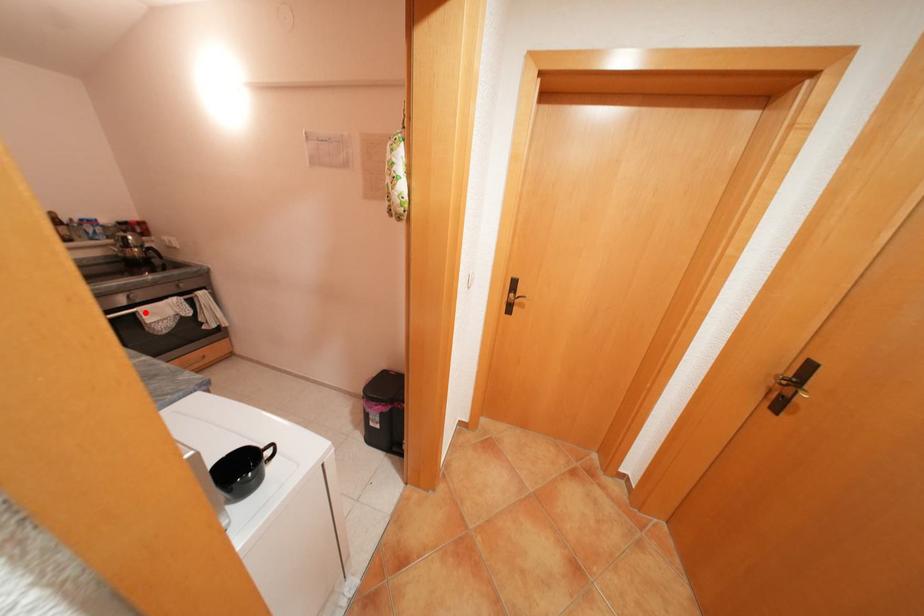
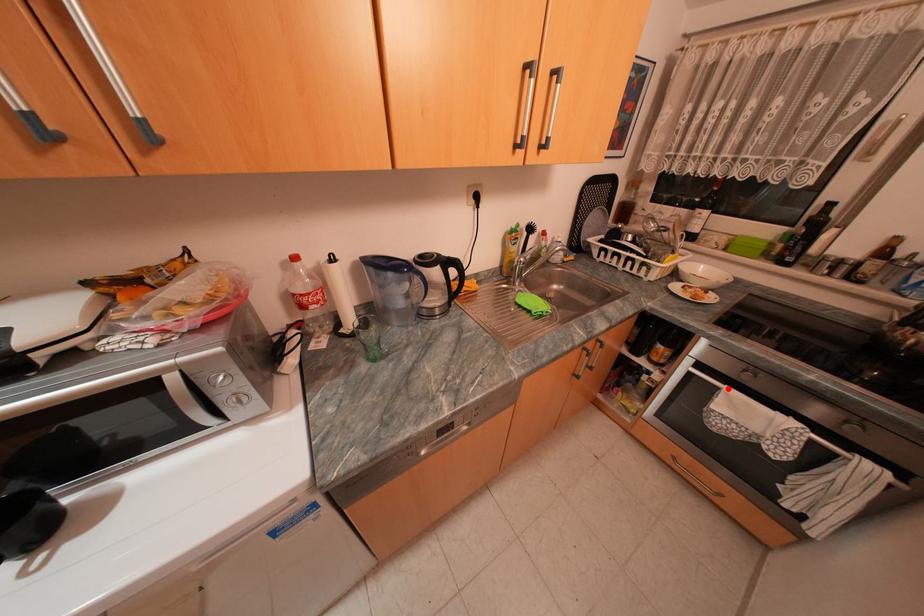
I am providing you with two images of the same scene from different viewpoints. A red point is marked on the first image and another point is marked on the second image. Do the highlighted points in image1 and image2 indicate the same real-world spot?

Yes